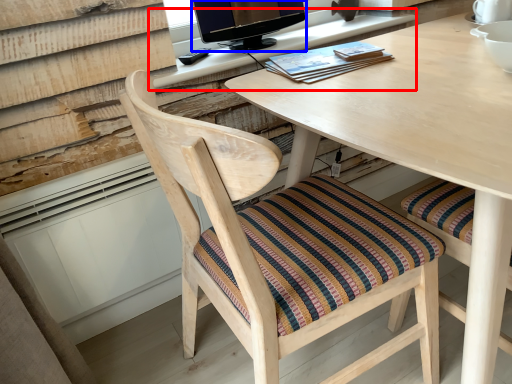
Question: Which object appears farthest to the camera in this image, computer desk (highlighted by a red box) or television (highlighted by a blue box)?

Choices:
 (A) computer desk
 (B) television

Answer: (B)